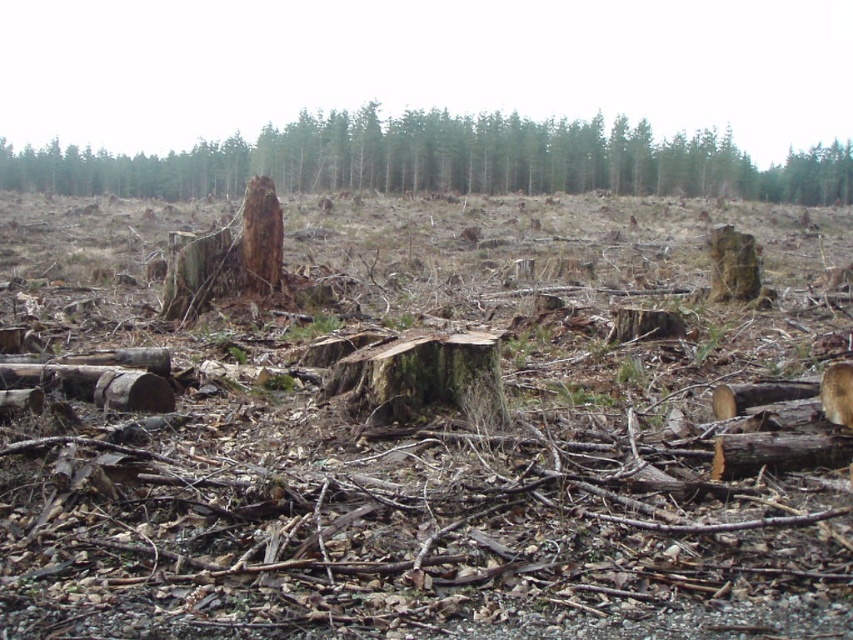
Does brown rough tree stump at center have a larger size compared to brown rough tree trunk at center?

Correct, brown rough tree stump at center is larger in size than brown rough tree trunk at center.

Does brown rough tree stump at center appear on the right side of brown rough tree trunk at center?

No, brown rough tree stump at center is not to the right of brown rough tree trunk at center.

Does point (392, 173) lie behind point (257, 212)?

Yes, it is.

You are a GUI agent. You are given a task and a screenshot of the screen. Output one action in this format:
    pyautogui.click(x=<x>, y=<y>)
    Task: Click on the brown rough tree stump at center
    
    Given the screenshot: What is the action you would take?
    pyautogui.click(x=444, y=161)